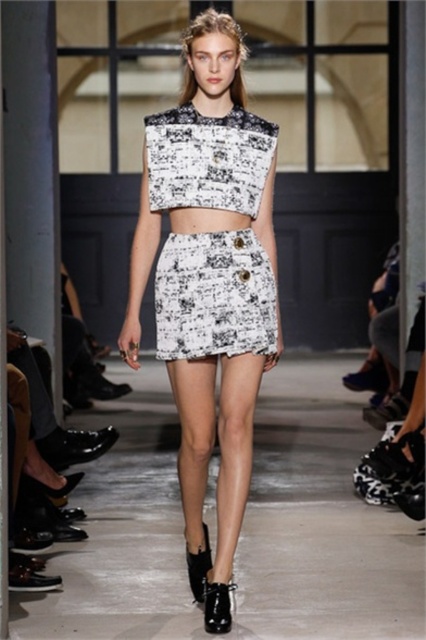
Between white printed fabric skirt at center and white printed fabric dress at center, which one appears on the left side from the viewer's perspective?

white printed fabric skirt at center

Is white printed fabric skirt at center wider than white printed fabric dress at center?

Correct, the width of white printed fabric skirt at center exceeds that of white printed fabric dress at center.

Is point (199, 454) farther from viewer compared to point (169, 196)?

No, it is in front of (169, 196).

Locate an element on the screen. white printed fabric skirt at center is located at coordinates (210, 285).